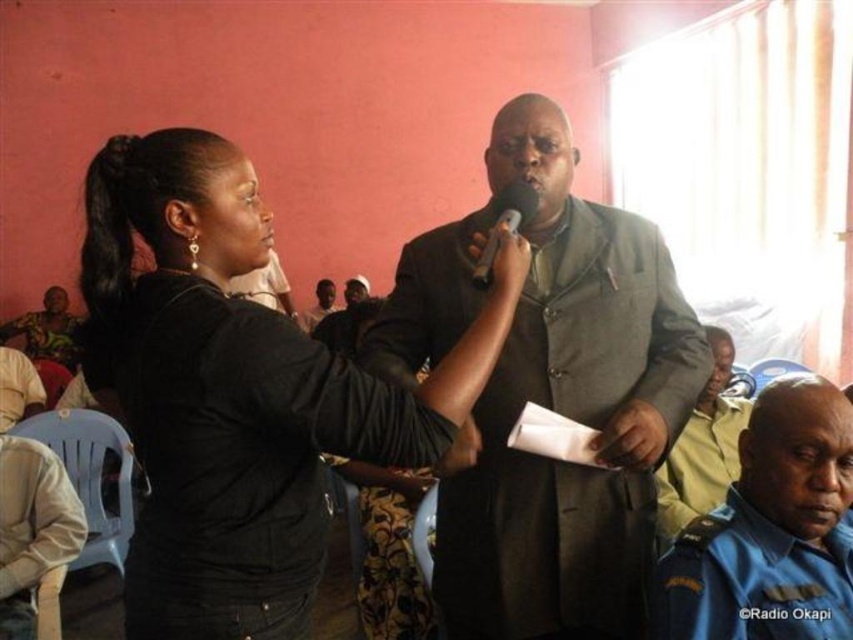
Question: Is dark gray suit at center further to camera compared to blue uniform at lower right?

Choices:
 (A) yes
 (B) no

Answer: (B)

Question: Does black matte jacket at center come behind matte black microphone at center?

Choices:
 (A) no
 (B) yes

Answer: (A)

Question: Which object is positioned closest to the light brown uniform at center?

Choices:
 (A) black matte jacket at center
 (B) dark gray suit at center
 (C) blue uniform at lower right
 (D) matte black microphone at center

Answer: (C)

Question: Which of these objects is positioned closest to the blue uniform at lower right?

Choices:
 (A) black matte jacket at center
 (B) light brown uniform at center
 (C) dark gray suit at center

Answer: (C)

Question: Among these objects, which one is farthest from the camera?

Choices:
 (A) matte black microphone at center
 (B) black matte jacket at center
 (C) blue uniform at lower right

Answer: (C)

Question: Is dark gray suit at center thinner than blue uniform at lower right?

Choices:
 (A) yes
 (B) no

Answer: (B)